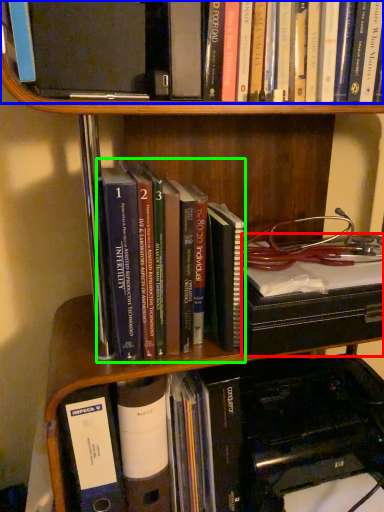
Question: Which is nearer to the book (highlighted by a red box)? book (highlighted by a blue box) or book (highlighted by a green box).

Choices:
 (A) book
 (B) book

Answer: (B)